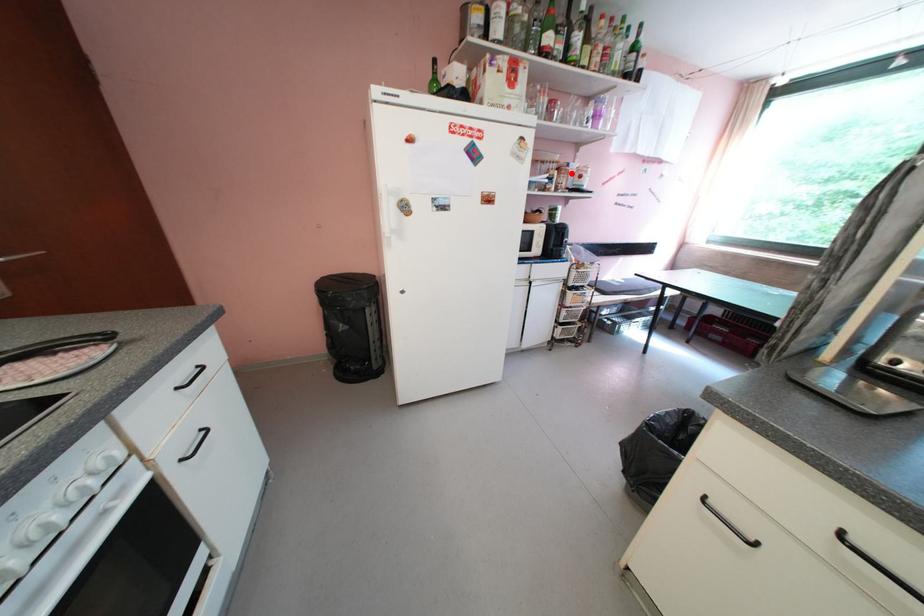
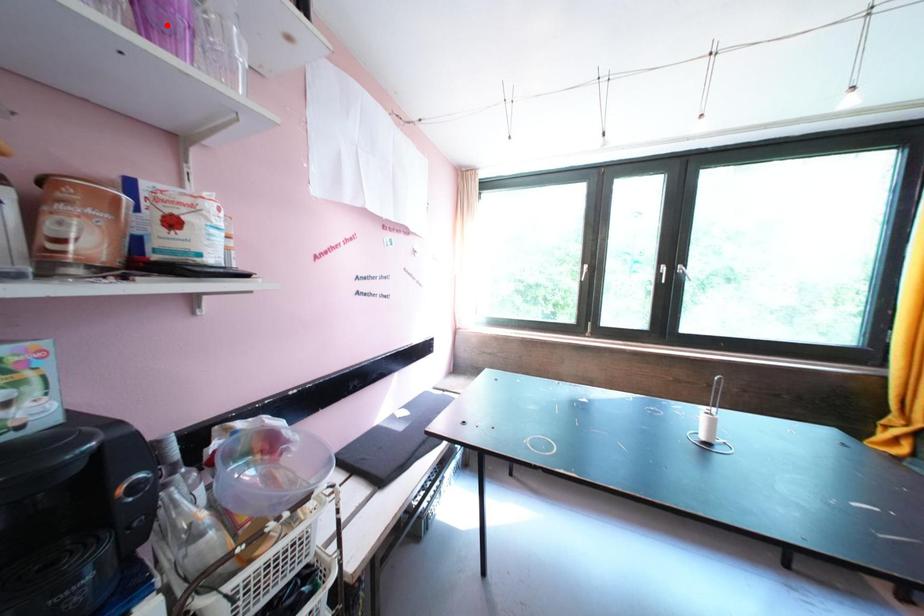
I am providing you with two images of the same scene from different viewpoints. A red point is marked on the first image and another point is marked on the second image. Is the marked point in image1 the same physical position as the marked point in image2?

No